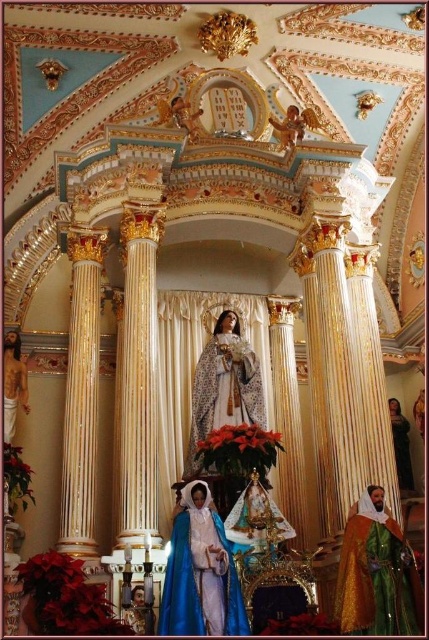
Question: Which point appears closest to the camera in this image?

Choices:
 (A) (257, 372)
 (B) (195, 593)

Answer: (B)

Question: Estimate the real-world distances between objects in this image. Which object is closer to the smooth golden statue at lower left?

Choices:
 (A) gold textured robe at lower right
 (B) dark blue velvet robe at right
 (C) matte white statue at center
 (D) blue velvet statue at center

Answer: (C)

Question: Is blue velvet statue at center to the left of matte white statue at center from the viewer's perspective?

Choices:
 (A) no
 (B) yes

Answer: (B)

Question: Estimate the real-world distances between objects in this image. Which object is farther from the blue velvet statue at center?

Choices:
 (A) smooth golden statue at lower left
 (B) gold textured robe at lower right
 (C) matte white statue at center
 (D) dark blue velvet robe at right

Answer: (D)

Question: Does gold textured robe at lower right appear under dark blue velvet robe at right?

Choices:
 (A) no
 (B) yes

Answer: (B)

Question: Does gold textured robe at lower right come in front of smooth golden statue at lower left?

Choices:
 (A) yes
 (B) no

Answer: (A)